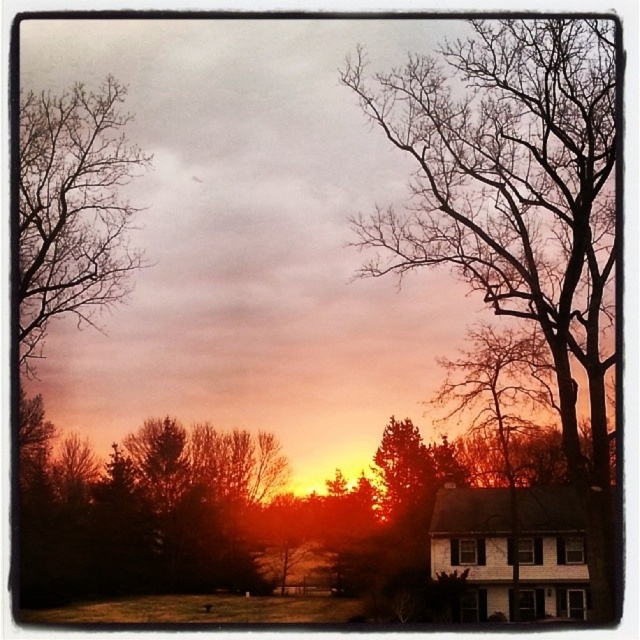
Is bare branches at center smaller than bare branches at upper left?

Incorrect, bare branches at center is not smaller in size than bare branches at upper left.

Is point (541, 138) farther from camera compared to point (45, 140)?

That is False.

Who is more distant from viewer, (x=596, y=486) or (x=54, y=166)?

The point (x=54, y=166) is more distant.

What are the coordinates of `bare branches at center` in the screenshot? It's located at (516, 221).